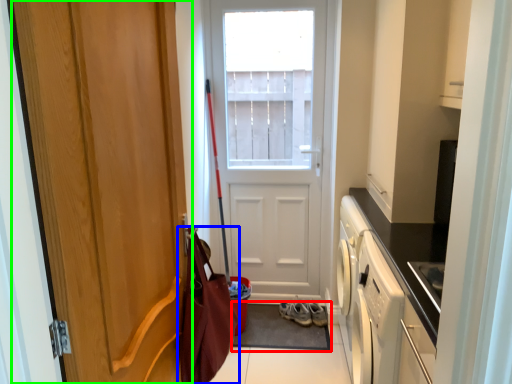
Question: Which object is the farthest from doormat (highlighted by a red box)? Choose among these: messenger bag (highlighted by a blue box) or door (highlighted by a green box).

Choices:
 (A) messenger bag
 (B) door

Answer: (B)